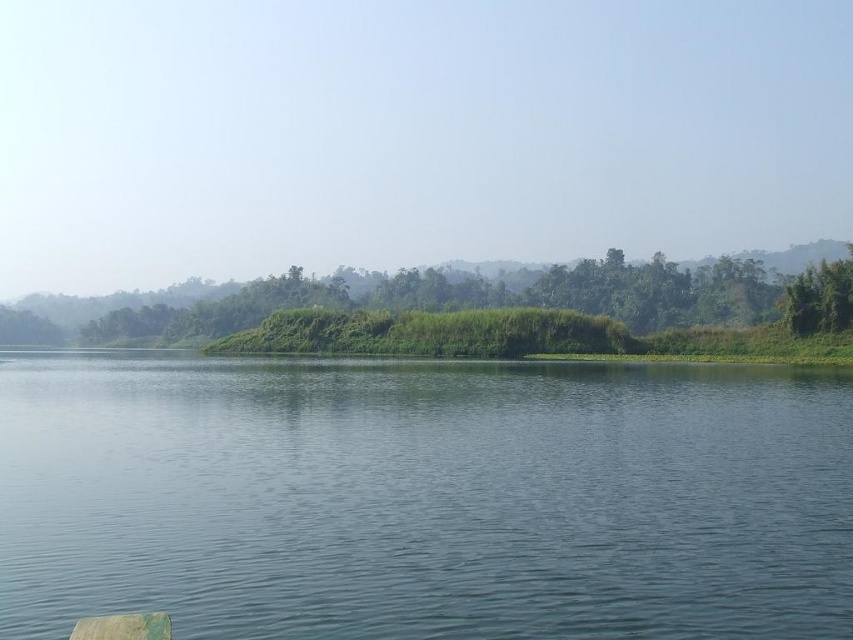
You are standing at the edge of the blue smooth water at center and want to throw a stone to the opposite side. If the water is 10 meters wide, will you be able to reach the other side with one throw?

The blue smooth water at center and viewer are 9.65 meters apart from each other. Since the water is 10 meters wide, you would need to throw the stone approximately 10 meters to reach the opposite side, but since you are already 9.65 meters away from the center, you might need to adjust your position or throw slightly further to cover the remaining distance.

You are standing on the green grassy mound at center and want to reach the blue smooth water at center. Based on the scene, which direction should you move to get there?

Since the blue smooth water at center is in front of the green grassy mound at center, you should move forward to reach the blue smooth water at center from the green grassy mound at center.